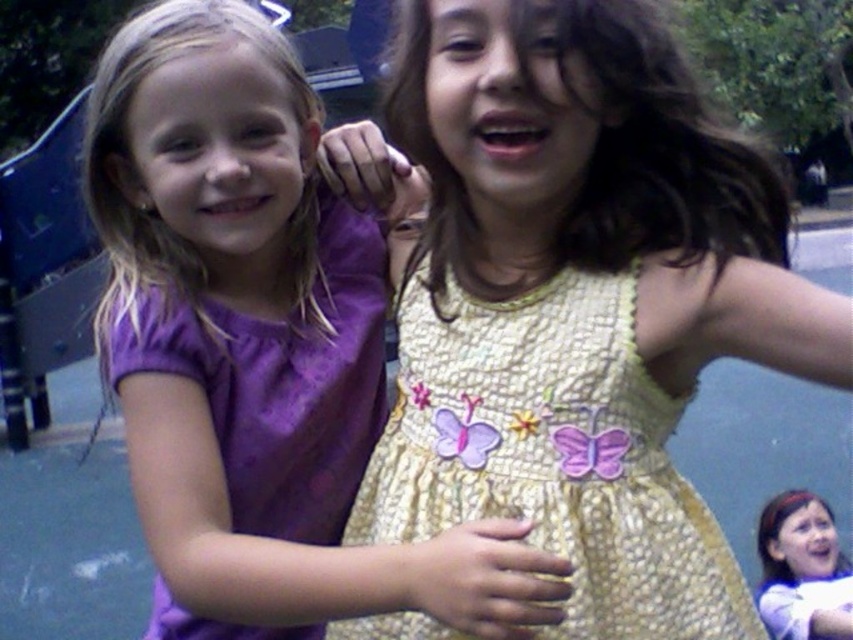
You are a photographer trying to capture the two girls in the scene. The purple satin dress at center is at coordinates point (256, 348). If you want to focus on the purple satin dress at center, where should you aim your camera?

The purple satin dress at center is located at point (256, 348), so you should aim your camera at that coordinate to focus on it.

You are a photographer trying to capture a closeup shot of the yellow textured dress at center and the matte purple dress at center. Which dress will appear larger in your photo?

The yellow textured dress at center will appear larger in the photo because it is closer to the viewer than the matte purple dress at center.